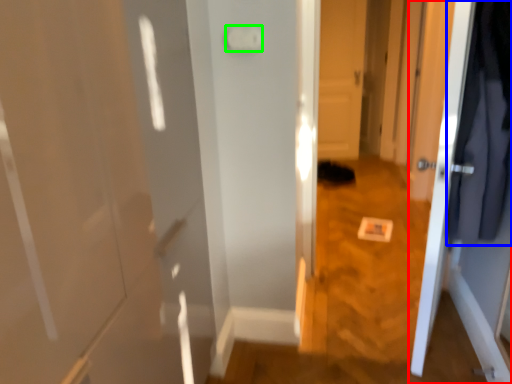
Question: Which is nearer to the door (highlighted by a red box)? clothing (highlighted by a blue box) or light switch (highlighted by a green box).

Choices:
 (A) clothing
 (B) light switch

Answer: (A)